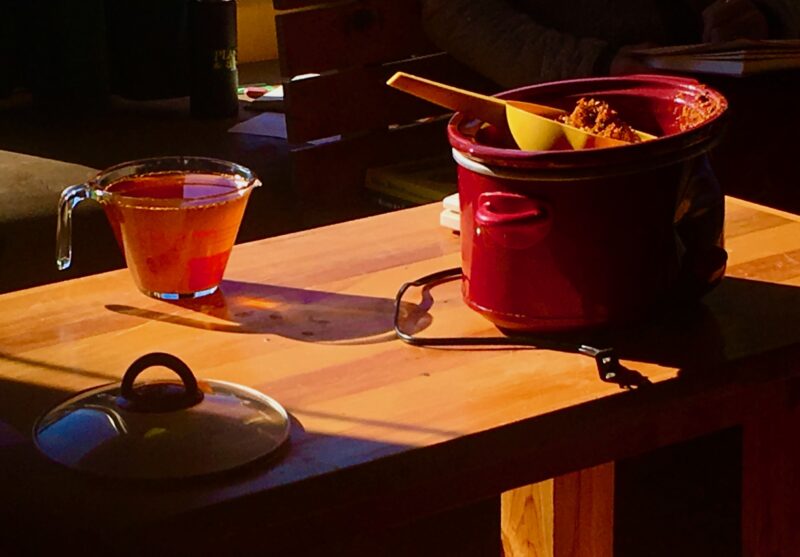
Where is `measuring cup`? measuring cup is located at coordinates (92, 188).